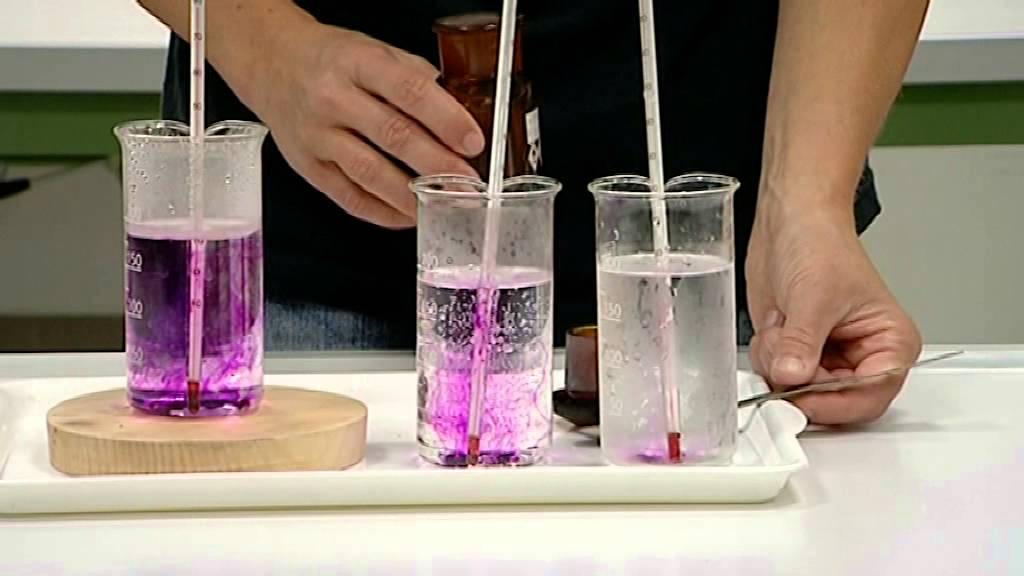
Identify the location of white tray. (418, 477).